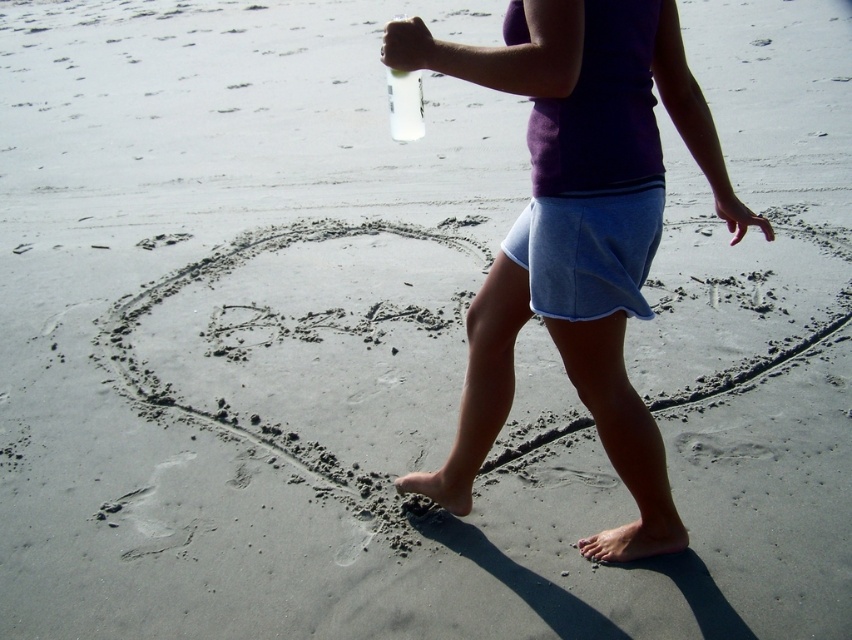
You are a fashion designer observing the beach scene. You need to decide which item to focus on for a new collection inspired by the scene. Which item is bigger in size between the purple fabric skirt at center and the clear plastic bottle at upper center?

The purple fabric skirt at center is larger in size than the clear plastic bottle at upper center, so the purple fabric skirt at center should be the focus for the new collection.

Consider the image. You are a photographer trying to capture the person in the scene. Since the purple fabric skirt at center and clear plastic bottle at upper center are both in the frame, which object should you focus on to ensure it appears larger in the photo?

The purple fabric skirt at center has a greater height compared to the clear plastic bottle at upper center, so focusing on the purple fabric skirt at center will make it appear larger in the photo.